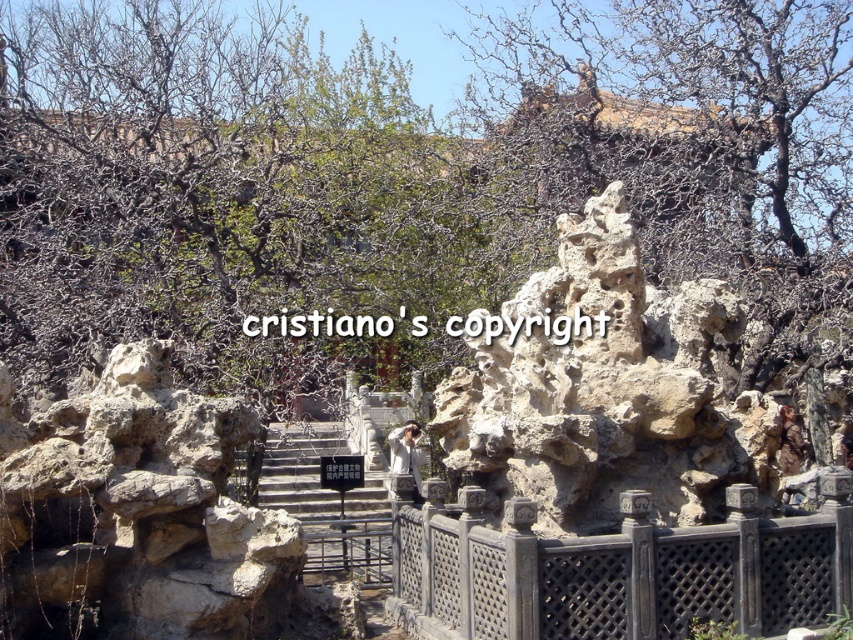
Does black stone fence at lower right appear on the right side of stone stairs at center?

Yes, black stone fence at lower right is to the right of stone stairs at center.

Does point (593, 582) come behind point (314, 428)?

No, (593, 582) is closer to viewer.

Is point (466, 486) closer to viewer compared to point (293, 496)?

Yes, it is in front of point (293, 496).

Image resolution: width=853 pixels, height=640 pixels. What are the coordinates of `black stone fence at lower right` in the screenshot? It's located at (616, 570).

Is point (711, 417) farther from viewer compared to point (584, 608)?

Yes, it is behind point (584, 608).

Where is `natural stone rock formation at center`? The image size is (853, 640). natural stone rock formation at center is located at coordinates (606, 388).

Which is behind, point (712, 340) or point (781, 580)?

Positioned behind is point (712, 340).

Find the location of a particular element. The height and width of the screenshot is (640, 853). natural stone rock formation at center is located at coordinates (606, 388).

Does natural stone rock formation at center have a greater width compared to stone stairs at center?

Indeed, natural stone rock formation at center has a greater width compared to stone stairs at center.

In the scene shown: Can you confirm if natural stone rock formation at center is thinner than stone stairs at center?

No, natural stone rock formation at center is not thinner than stone stairs at center.

I want to click on natural stone rock formation at center, so click(606, 388).